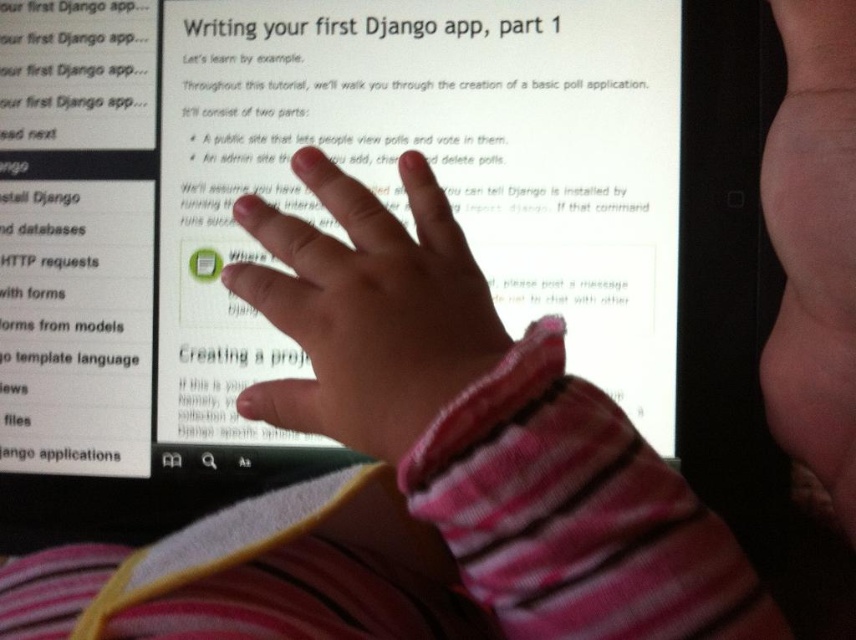
Based on the scene described, where is the pink fabric hand at center located in terms of coordinates?

The pink fabric hand at center is located at the 2D coordinates point of (367, 308).

You are a developer observing a child learning to code. You see the pink fabric hand at center and the pink fabric hand at upper right on the tablet screen. Which hand is positioned lower on the screen?

The pink fabric hand at center is positioned lower on the screen than the pink fabric hand at upper right.

You are a developer trying to determine which hand is closer to the edge of the tablet screen. Based on the scene, which hand, the pink fabric hand at center or the pink fabric hand at upper right, is wider?

The pink fabric hand at center is wider than the pink fabric hand at upper right.